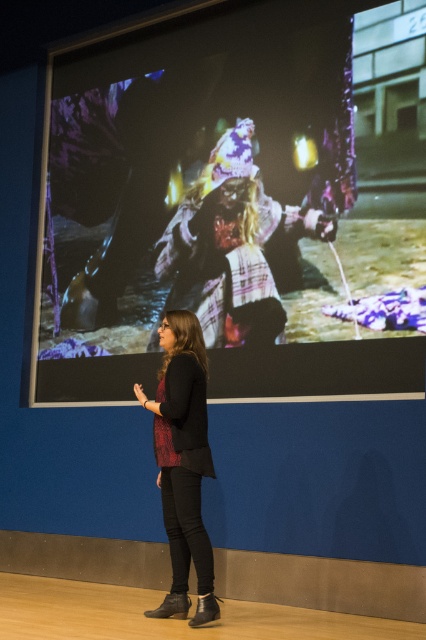
From the picture: You are an event organizer who needs to ensure that the presentation area is set up correctly. Given the scene described, which object is wider between the matte black screen at center and the matte black pants at center?

The matte black screen at center is wider than the matte black pants at center according to the description provided.

You are attending a presentation and want to take a photo of the projection screen. The camera you have can only focus on objects within 5 meters. Is the point at coordinates point (71, 326) on the screen within the camera focus range?

The point at coordinates point (71, 326) is 5.63 meters away from the camera, which is beyond the 5 meter focus range. The camera cannot focus on it.